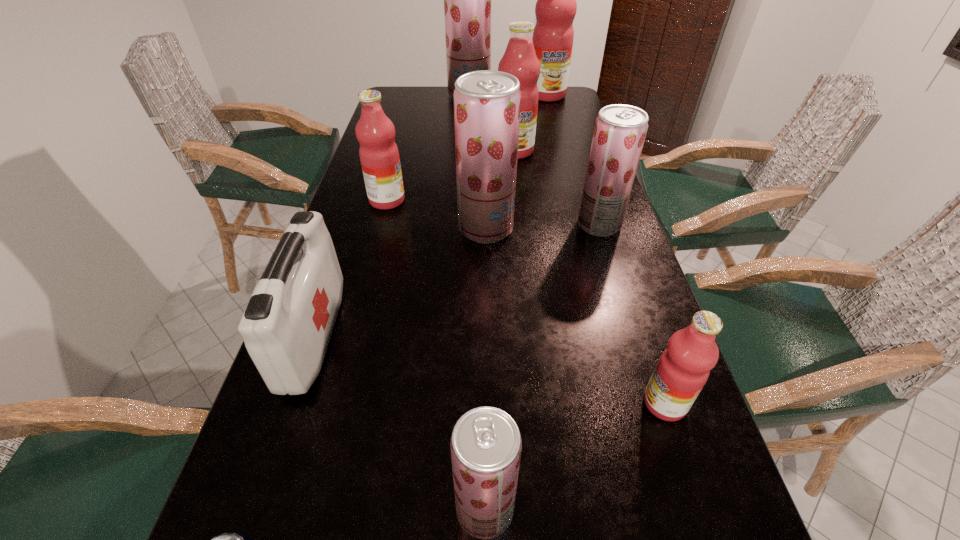
The width and height of the screenshot is (960, 540). What are the coordinates of `unoccupied area between the farthest strawberry fruit juice and the leftmost pink fruit juice` in the screenshot? It's located at (428, 147).

Identify which object is the ninth closest to the first-aid kit. Please provide its 2D coordinates. Your answer should be formatted as a tuple, i.e. [(x, y)], where the tuple contains the x and y coordinates of a point satisfying the conditions above.

[(556, 7)]

Locate an element on the screen. object that is the ninth closest to the biggest strawberry fruit juice is located at coordinates (227, 539).

I want to click on fruit juice that is the fourth closest to the third farthest object, so click(467, 0).

Locate which fruit juice is the second closest to the rightmost strawberry fruit juice. Please provide its 2D coordinates. Your answer should be formatted as a tuple, i.e. [(x, y)], where the tuple contains the x and y coordinates of a point satisfying the conditions above.

[(520, 60)]

The height and width of the screenshot is (540, 960). I want to click on strawberry fruit juice object that ranks as the second closest to the second nearest object, so click(620, 130).

Locate which strawberry fruit juice ranks third in proximity to the ninth farthest object. Please provide its 2D coordinates. Your answer should be formatted as a tuple, i.e. [(x, y)], where the tuple contains the x and y coordinates of a point satisfying the conditions above.

[(467, 0)]

Locate which pink fruit juice ranks in proximity to the biggest pink fruit juice. Please provide its 2D coordinates. Your answer should be formatted as a tuple, i.e. [(x, y)], where the tuple contains the x and y coordinates of a point satisfying the conditions above.

[(520, 60)]

Choose which pink fruit juice is the third nearest neighbor to the smallest strawberry fruit juice. Please provide its 2D coordinates. Your answer should be formatted as a tuple, i.e. [(x, y)], where the tuple contains the x and y coordinates of a point satisfying the conditions above.

[(520, 60)]

Identify the location of vacant position in the image that satisfies the following two spatial constraints: 1. on the label of the fifth nearest fruit juice; 2. on the back side of the rightmost strawberry fruit juice. (380, 225).